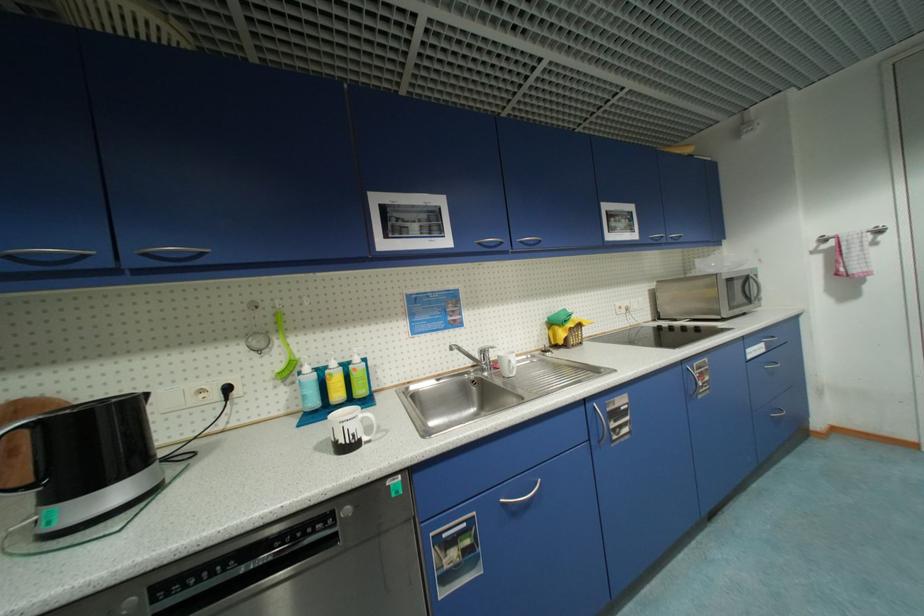
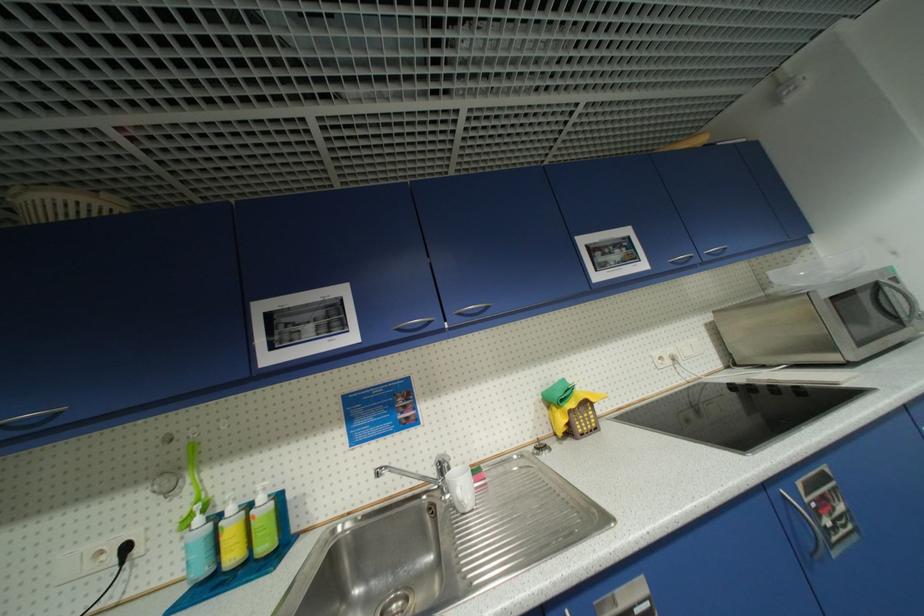
The point at (527,244) is marked in the first image. Where is the corresponding point in the second image?

(466, 315)